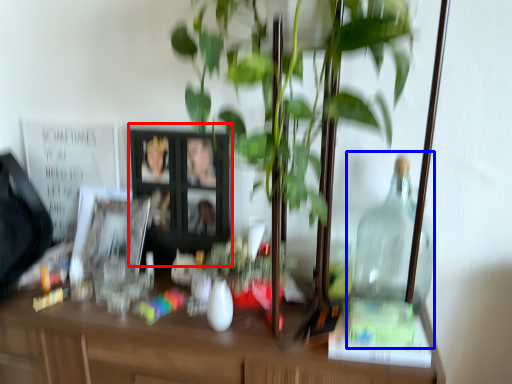
Question: Which of the following is the closest to the observer, picture frame (highlighted by a red box) or glass jar (highlighted by a blue box)?

Choices:
 (A) picture frame
 (B) glass jar

Answer: (B)